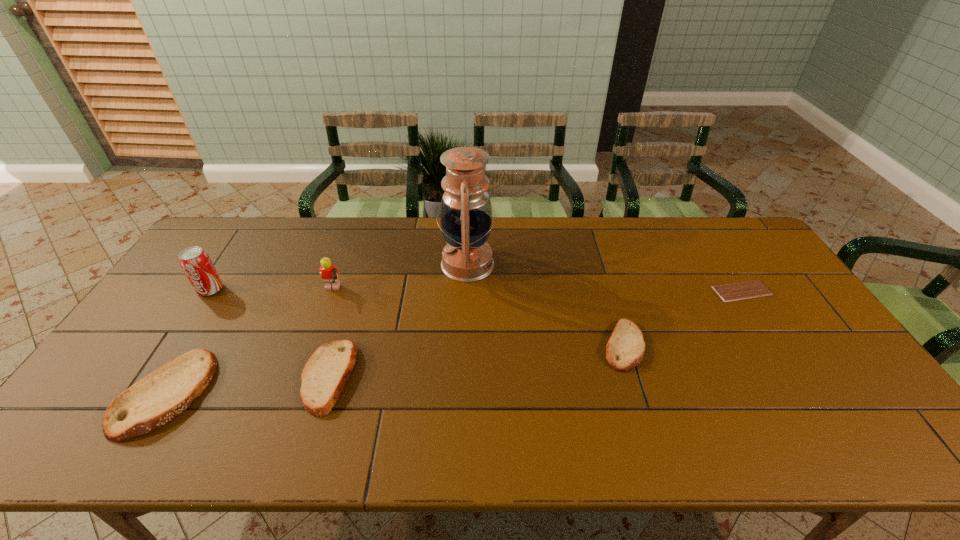
Find the location of a particular element. The width and height of the screenshot is (960, 540). empty space that is in between the fourth shortest object and the sixth shortest object is located at coordinates (188, 342).

Find the location of a particular element. vacant area that lies between the soda can and the second pita bread from left to right is located at coordinates (270, 333).

I want to click on free space between the tallest object and the rightmost object, so click(x=605, y=278).

Where is `blank region between the tallest object and the sixth tallest object`? Image resolution: width=960 pixels, height=540 pixels. blank region between the tallest object and the sixth tallest object is located at coordinates (545, 305).

Identify the location of free spot between the third tallest object and the second object from right to left. (477, 319).

This screenshot has width=960, height=540. I want to click on free space between the second pita bread from right to left and the second shortest object, so click(476, 361).

Identify the location of free spot between the tallest object and the third tallest object. Image resolution: width=960 pixels, height=540 pixels. coord(399,278).

The height and width of the screenshot is (540, 960). Find the location of `free space that is in between the chocolate bar and the third object from right to left`. free space that is in between the chocolate bar and the third object from right to left is located at coordinates (605, 278).

Locate an element on the screen. object identified as the third closest to the fifth object from left to right is located at coordinates (625, 348).

The height and width of the screenshot is (540, 960). I want to click on the second closest object to the soda can, so click(x=329, y=273).